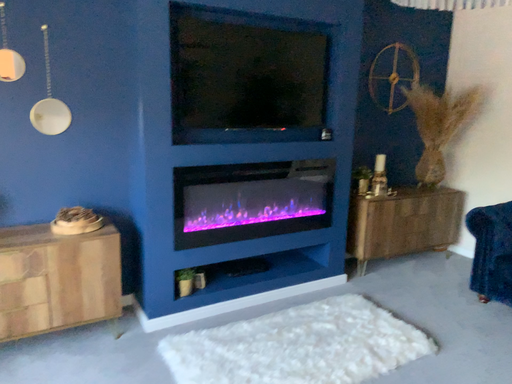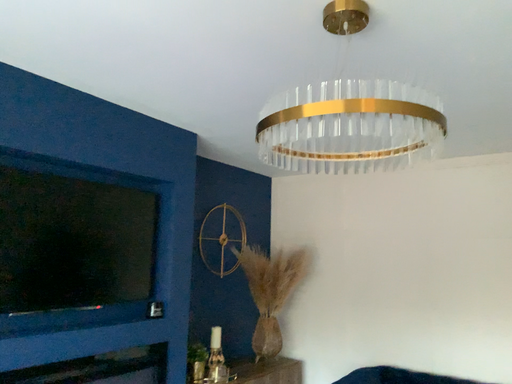
Question: Which way did the camera rotate in the video?

Choices:
 (A) rotated upward
 (B) rotated downward

Answer: (A)